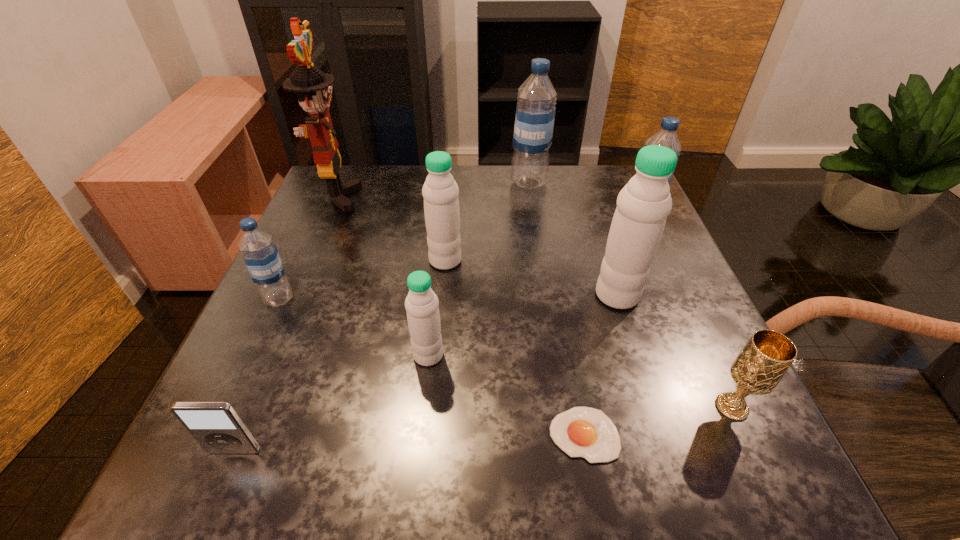
Where is `nutcracker positioned at the far edge`? Image resolution: width=960 pixels, height=540 pixels. nutcracker positioned at the far edge is located at coordinates (313, 87).

Identify the location of iPod located in the near edge section of the desktop. The width and height of the screenshot is (960, 540). (216, 426).

Find the location of `egg yolk at the near edge`. egg yolk at the near edge is located at coordinates click(586, 432).

Image resolution: width=960 pixels, height=540 pixels. I want to click on nutcracker located at the left edge, so click(313, 87).

Identify the location of water bottle present at the left edge. (260, 254).

Where is `iPod positioned at the left edge`? This screenshot has width=960, height=540. iPod positioned at the left edge is located at coordinates (216, 426).

At what (x,y) coordinates should I click in order to perform the action: click on chalice situated at the right edge. Please return your answer as a coordinate pair (x, y). Looking at the image, I should click on (759, 367).

You are a GUI agent. You are given a task and a screenshot of the screen. Output one action in this format:
    pyautogui.click(x=<x>, y=<y>)
    Task: Click on the object at the far left corner
    This screenshot has width=960, height=540.
    Given the screenshot: What is the action you would take?
    pyautogui.click(x=313, y=87)

Find the location of a particular element. object present at the near left corner is located at coordinates (216, 426).

Identify the location of object that is at the far right corner. (666, 136).